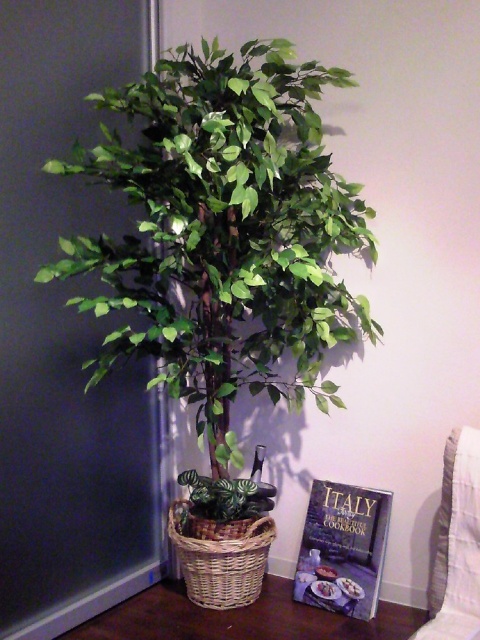
Question: Which point is farther to the camera?

Choices:
 (A) hardcover cookbook at lower right
 (B) brown wicker basket at lower center
 (C) green leafy tree at center
 (D) woven brown basket at center

Answer: (A)

Question: Among these objects, which one is nearest to the camera?

Choices:
 (A) woven brown basket at center
 (B) hardcover cookbook at lower right

Answer: (A)

Question: Is the position of green leafy tree at center less distant than that of hardcover cookbook at lower right?

Choices:
 (A) no
 (B) yes

Answer: (B)

Question: Is brown wicker basket at lower center positioned at the back of woven brown basket at center?

Choices:
 (A) no
 (B) yes

Answer: (A)

Question: Which point is farther to the camera?

Choices:
 (A) (199, 570)
 (B) (308, 580)

Answer: (B)

Question: Is green leafy tree at center closer to camera compared to brown wicker basket at lower center?

Choices:
 (A) no
 (B) yes

Answer: (B)